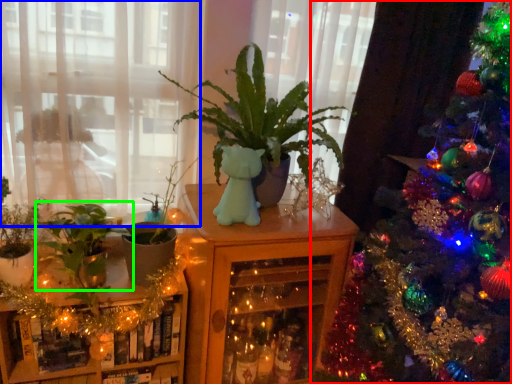
Question: Which object is the farthest from christmas tree (highlighted by a red box)? Choose among these: window (highlighted by a blue box) or houseplant (highlighted by a green box).

Choices:
 (A) window
 (B) houseplant

Answer: (A)